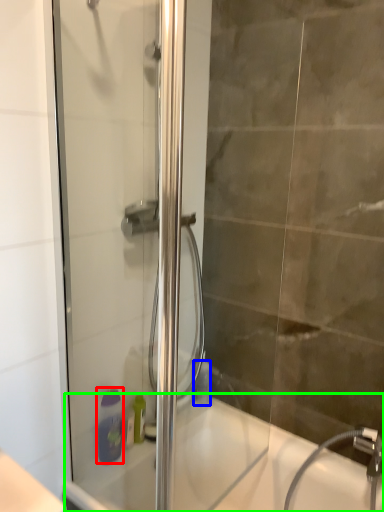
Question: Which object is the closest to the soap dispenser (highlighted by a red box)? Choose among these: toiletry (highlighted by a blue box) or bath (highlighted by a green box).

Choices:
 (A) toiletry
 (B) bath

Answer: (B)